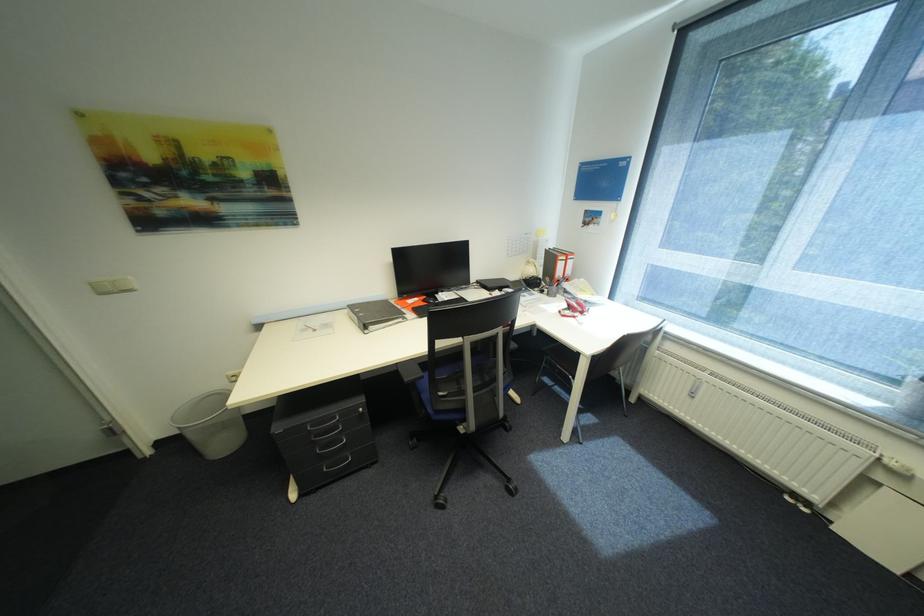
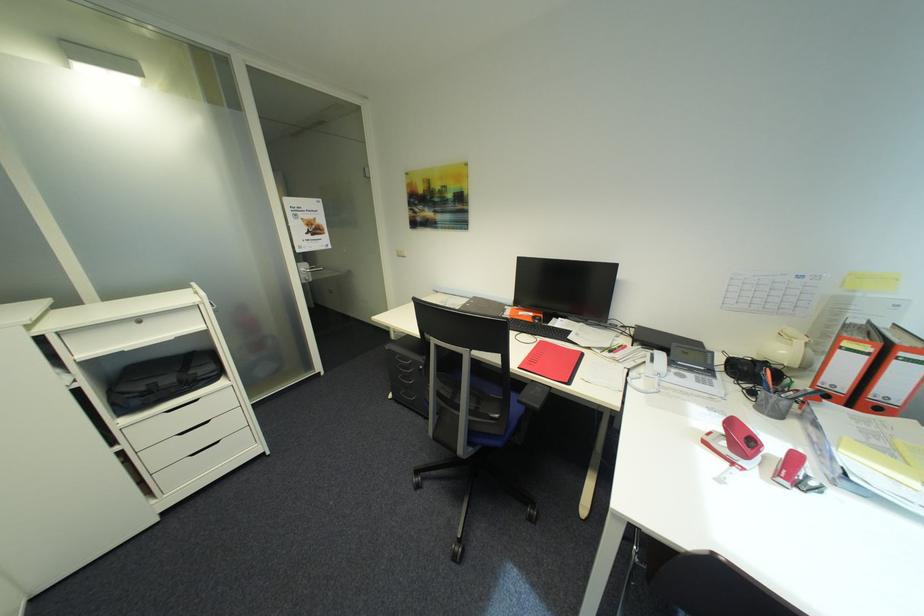
Locate, in the second image, the point that corresponds to point 582,317 in the first image.

(742, 464)